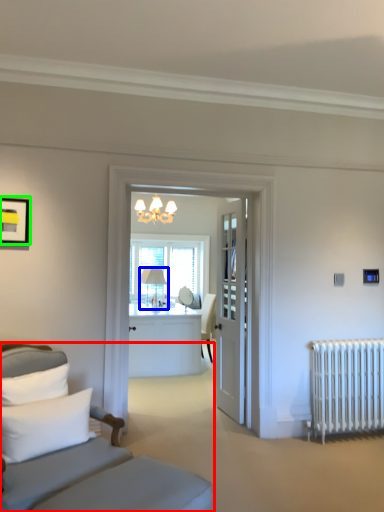
Question: Which is nearer to the studio couch (highlighted by a red box)? table lamp (highlighted by a blue box) or picture frame (highlighted by a green box).

Choices:
 (A) table lamp
 (B) picture frame

Answer: (B)